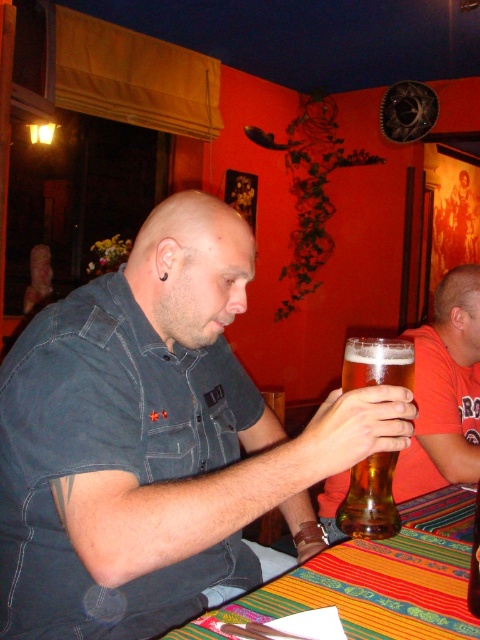
In the scene shown: You are a waiter in a busy restaurant and need to place a new order on the table. The table has a denim shirt at center and a golden glass beer at center. Which item should you move first to make space for the new plate?

The denim shirt at center is larger in size than the golden glass beer at center, so you should move the denim shirt at center first to make space for the new plate.

You are a waiter in this dining area and need to place a new menu on the table. The menu is 10 cm tall. There is space between the denim shirt at center and the golden glass beer at center. Can the menu fit vertically between them?

The denim shirt at center is taller than the golden glass beer at center. The vertical space between them would depend on their combined heights. However, since the menu is only 10 cm tall, it might fit if the space between them is at least 10 cm. Without exact measurements, we cannot confirm, but given the shirt is taller, there might be sufficient space.